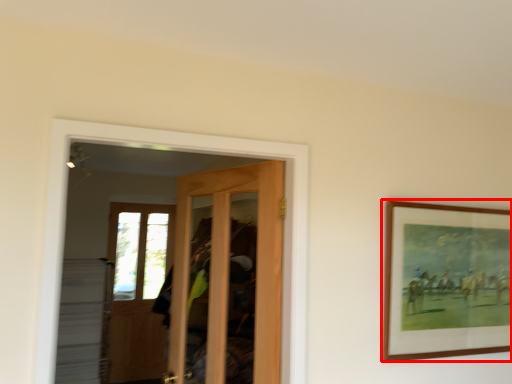
Question: In this image, where is picture frame (annotated by the red box) located relative to door?

Choices:
 (A) right
 (B) left

Answer: (A)